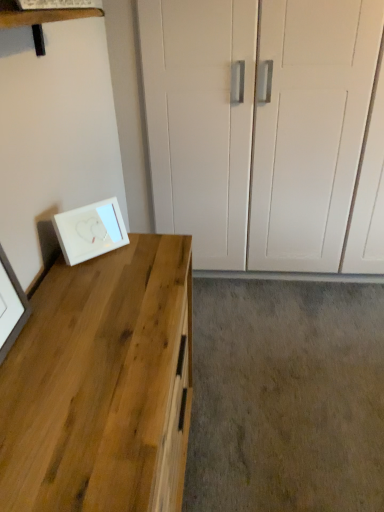
This screenshot has width=384, height=512. Identify the location of vacant area that is in front of white glossy picture frame at lower left. (91, 279).